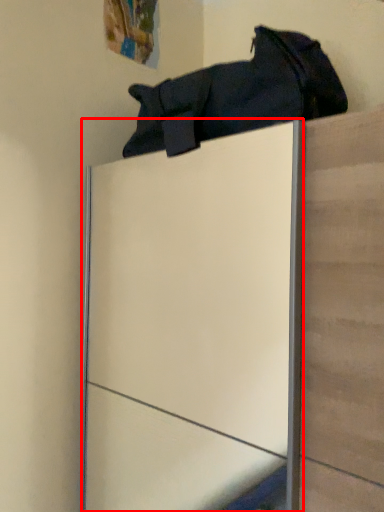
Question: From the image's perspective, what is the correct spatial relationship of glass door (annotated by the red box) in relation to footwear?

Choices:
 (A) below
 (B) above

Answer: (A)